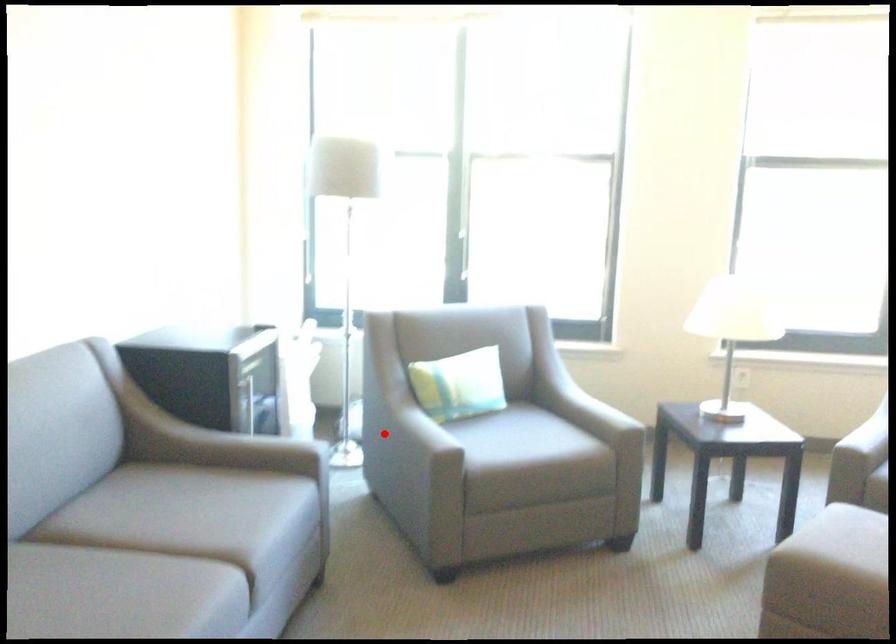
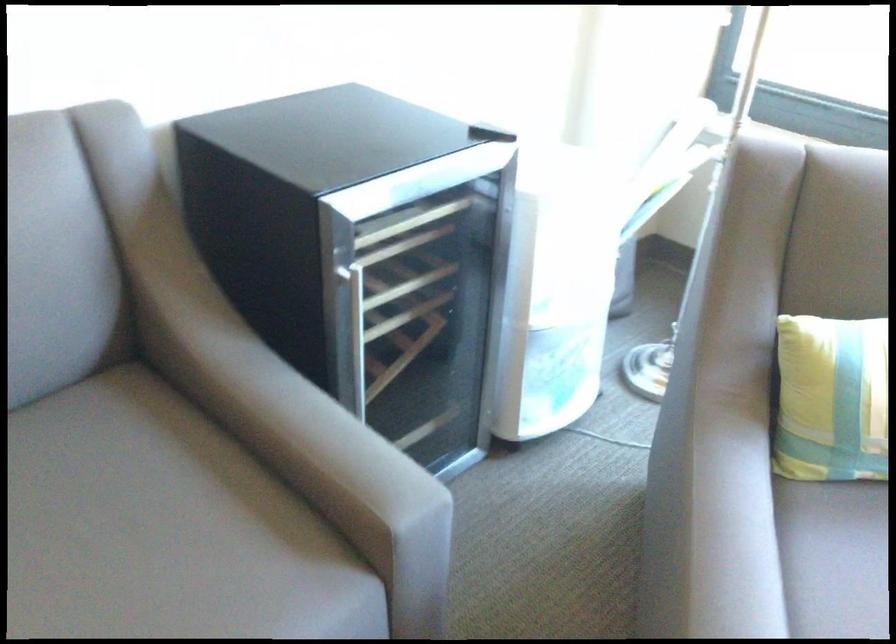
In the second image, find the point that corresponds to the highlighted location in the first image.

(711, 522)